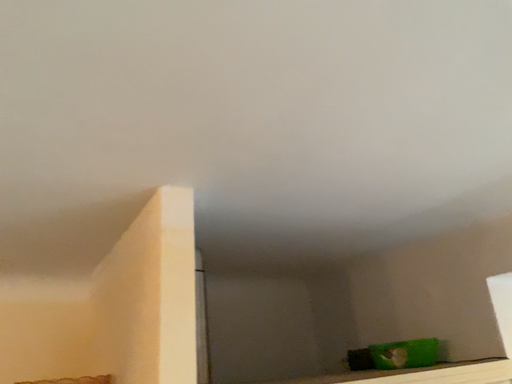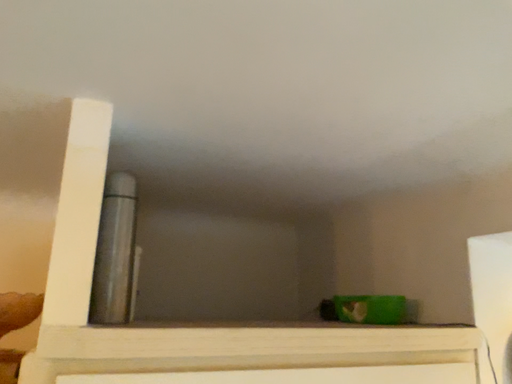
Question: How did the camera likely rotate when shooting the video?

Choices:
 (A) rotated upward
 (B) rotated downward

Answer: (B)